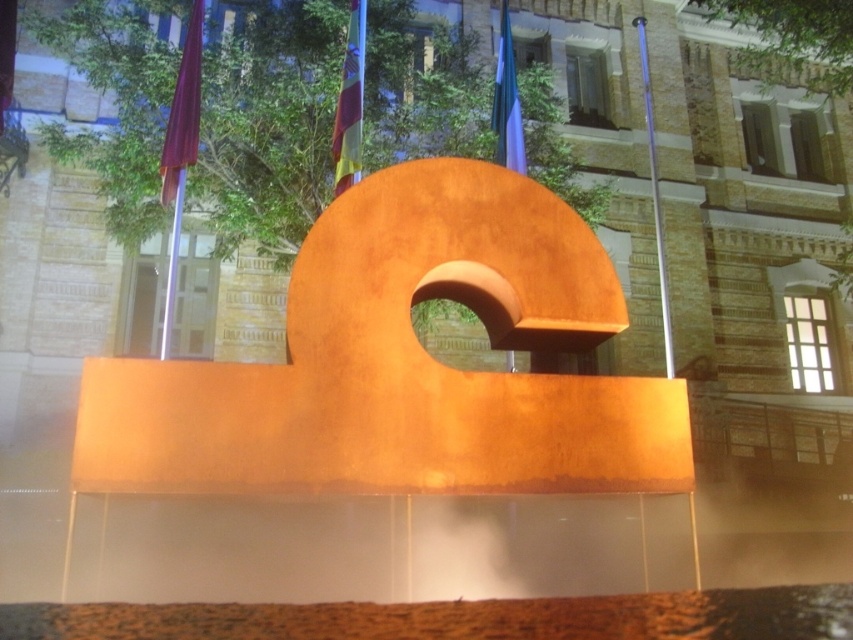
You are standing in front of the sculpture and want to hang a small decorative item on the part of the rustic wood sculpture at center that is closest to the silky blue flag at upper center. Which direction should you look to find this spot?

The rustic wood sculpture at center is located below the silky blue flag at upper center, so the closest point on the rustic wood sculpture at center to the silky blue flag at upper center would be its uppermost part. You should look upwards towards the top of the rustic wood sculpture at center to find this spot.

You are a photographer trying to capture both the matte red flag at upper left and the silky blue flag at upper center in a single shot. Based on their positions, which flag would require you to adjust your camera angle more to include both in the frame?

The matte red flag at upper left is wider than the silky blue flag at upper center, so it would require adjusting the camera angle more to ensure both flags are fully captured in the frame.